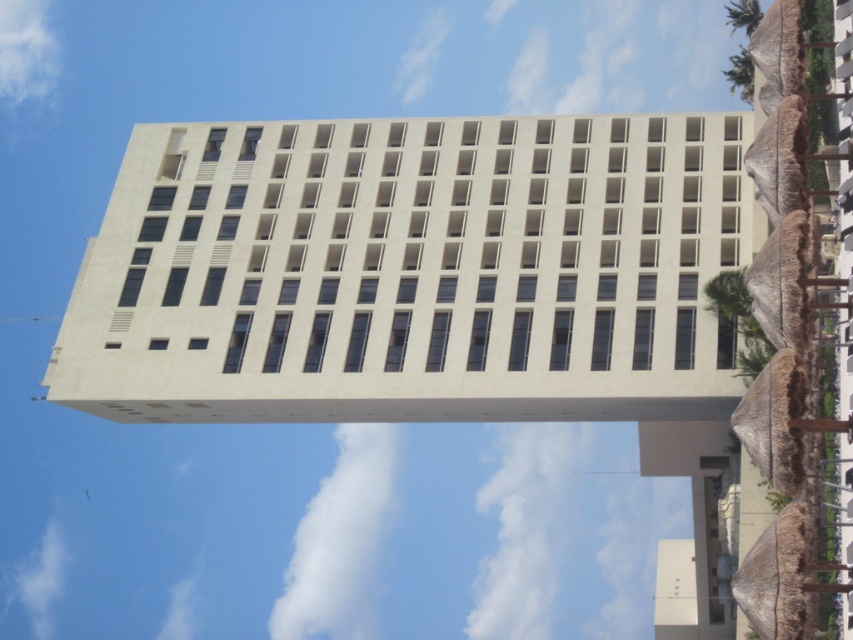
Question: In this image, where is white fluffy cloud at upper center located relative to green leafy palm tree at upper right?

Choices:
 (A) left
 (B) right

Answer: (A)

Question: Is beige concrete building at center smaller than white fluffy cloud at lower left?

Choices:
 (A) yes
 (B) no

Answer: (B)

Question: Considering the relative positions of beige concrete building at center and white fluffy cloud at lower left in the image provided, where is beige concrete building at center located with respect to white fluffy cloud at lower left?

Choices:
 (A) left
 (B) right

Answer: (B)

Question: Among these points, which one is nearest to the camera?

Choices:
 (A) (712, 307)
 (B) (315, 504)

Answer: (A)

Question: Among these points, which one is nearest to the camera?

Choices:
 (A) (734, 289)
 (B) (663, 371)

Answer: (A)

Question: Which of the following is the farthest from the observer?

Choices:
 (A) (734, 307)
 (B) (305, 596)

Answer: (B)